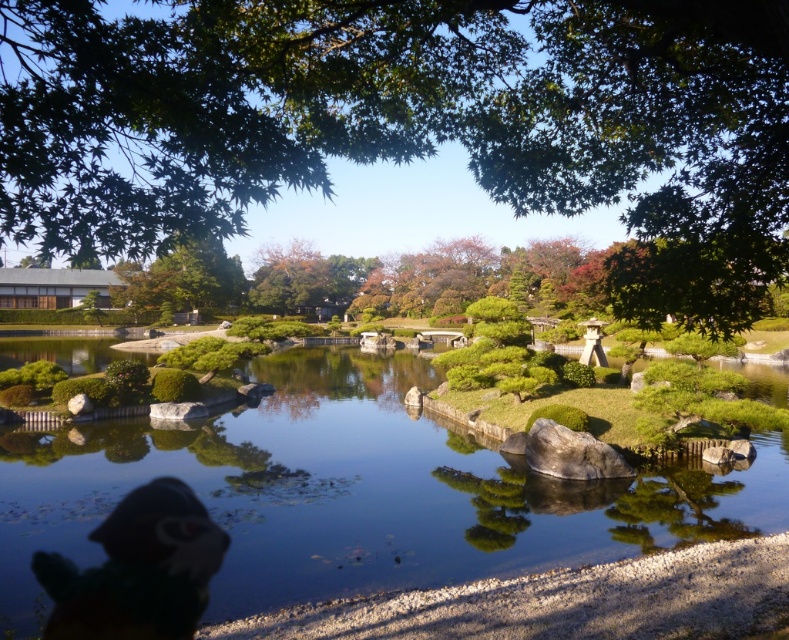
You are a visitor in the Japanese garden and want to take a photo of the green leafy tree at upper center and the multicolored plush toy at lower left. Which object should you focus on first if you want to capture both in a single frame without moving the camera?

You should focus on the green leafy tree at upper center first because it is larger in size than the multicolored plush toy at lower left, so it will require more attention in the frame.

Based on the photo, you are a photographer planning to capture the clear water at center and the gray smooth rock at center in a single shot. Based on the scene, which object will appear closer to the camera in the photo?

The clear water at center will appear closer to the camera because it is positioned in front of the gray smooth rock at center.

You are a visitor in the Japanese garden and want to know which object is higher between the clear water at center and the gray smooth rock at center. Can you tell me?

The clear water at center is much taller than the gray smooth rock at center.